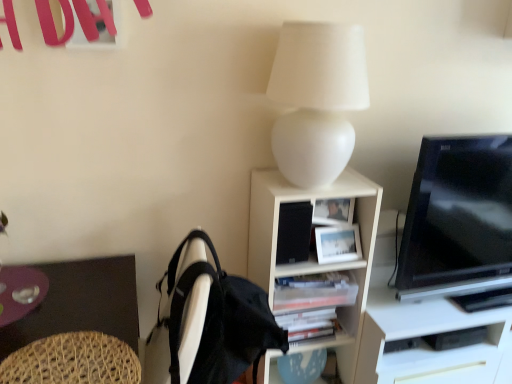
Question: Is transparent glass plate at lower left touching black glossy tv at right?

Choices:
 (A) no
 (B) yes

Answer: (A)

Question: Is transparent glass plate at lower left taller than black glossy tv at right?

Choices:
 (A) no
 (B) yes

Answer: (A)

Question: Is transparent glass plate at lower left wider than black glossy tv at right?

Choices:
 (A) yes
 (B) no

Answer: (A)

Question: From a real-world perspective, is transparent glass plate at lower left over black glossy tv at right?

Choices:
 (A) yes
 (B) no

Answer: (B)

Question: Is transparent glass plate at lower left positioned far away from black glossy tv at right?

Choices:
 (A) no
 (B) yes

Answer: (B)

Question: Is transparent glass plate at lower left positioned behind black glossy tv at right?

Choices:
 (A) no
 (B) yes

Answer: (A)

Question: Is black glossy tv at right shorter than black matte speaker at center?

Choices:
 (A) yes
 (B) no

Answer: (B)

Question: Can you see black glossy tv at right touching black matte speaker at center?

Choices:
 (A) yes
 (B) no

Answer: (B)

Question: Is black glossy tv at right bigger than black matte speaker at center?

Choices:
 (A) no
 (B) yes

Answer: (B)

Question: Is black glossy tv at right wider than black matte speaker at center?

Choices:
 (A) yes
 (B) no

Answer: (A)

Question: From a real-world perspective, is black glossy tv at right located beneath black matte speaker at center?

Choices:
 (A) no
 (B) yes

Answer: (A)

Question: Is black glossy tv at right positioned before black matte speaker at center?

Choices:
 (A) no
 (B) yes

Answer: (B)

Question: Considering the relative sizes of black glossy tv at right and woven wood swivel chair at lower left in the image provided, is black glossy tv at right bigger than woven wood swivel chair at lower left?

Choices:
 (A) yes
 (B) no

Answer: (A)